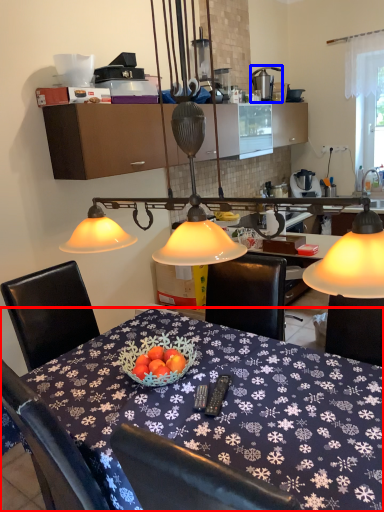
Question: Which object appears farthest to the camera in this image, desk (highlighted by a red box) or tableware (highlighted by a blue box)?

Choices:
 (A) desk
 (B) tableware

Answer: (B)